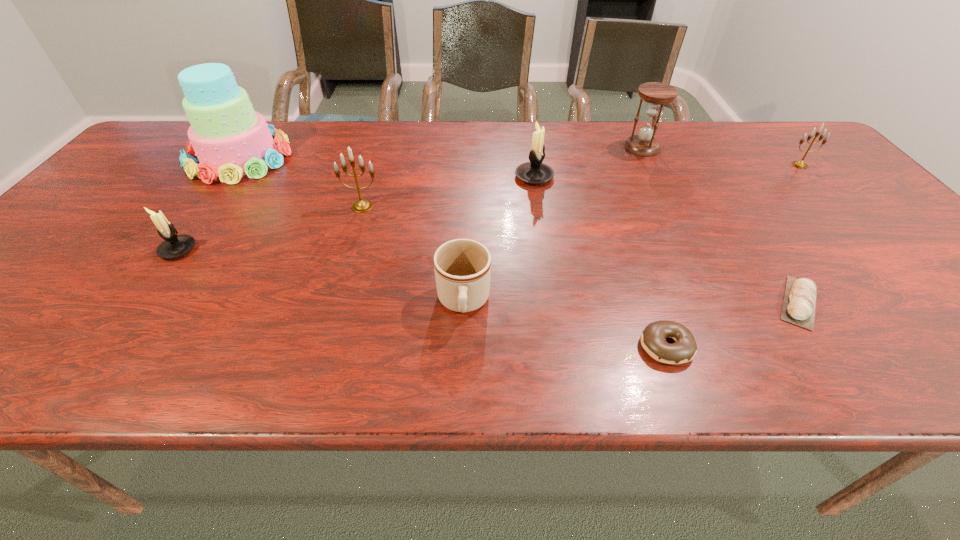
Identify the location of cake. This screenshot has height=540, width=960. (230, 139).

This screenshot has width=960, height=540. I want to click on blue cake, so click(230, 139).

Image resolution: width=960 pixels, height=540 pixels. I want to click on hourglass, so pos(644,144).

Image resolution: width=960 pixels, height=540 pixels. I want to click on the farther white candle holder, so click(x=534, y=172).

Locate an element on the screen. The image size is (960, 540). the right white candle holder is located at coordinates (534, 172).

Locate an element on the screen. the third farthest candelabrum is located at coordinates (362, 205).

Image resolution: width=960 pixels, height=540 pixels. I want to click on the third candelabrum from right to left, so click(x=362, y=205).

Find the location of a particular element. the nearest candelabrum is located at coordinates (173, 246).

In order to click on the leftmost candelabrum in this screenshot , I will do `click(173, 246)`.

The width and height of the screenshot is (960, 540). What are the coordinates of `the right gold candelabrum` in the screenshot? It's located at [x=799, y=164].